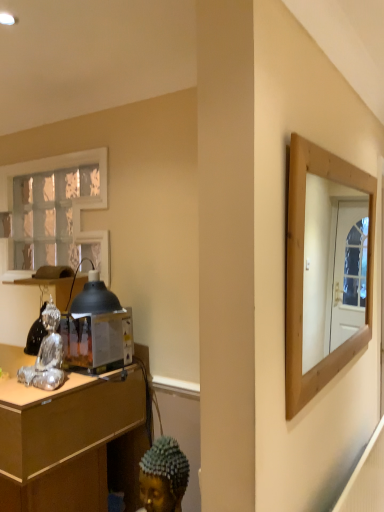
Question: Should I look upward or downward to see wooden desk at left?

Choices:
 (A) up
 (B) down

Answer: (B)

Question: Can you confirm if wooden desk at left is bigger than silver metallic figurine at left?

Choices:
 (A) yes
 (B) no

Answer: (A)

Question: Is wooden desk at left positioned beyond the bounds of silver metallic figurine at left?

Choices:
 (A) no
 (B) yes

Answer: (B)

Question: Considering the relative positions of wooden desk at left and silver metallic figurine at left in the image provided, is wooden desk at left to the left of silver metallic figurine at left from the viewer's perspective?

Choices:
 (A) no
 (B) yes

Answer: (B)

Question: Does wooden desk at left have a lesser height compared to silver metallic figurine at left?

Choices:
 (A) yes
 (B) no

Answer: (A)

Question: Would you say wooden desk at left is a long distance from silver metallic figurine at left?

Choices:
 (A) yes
 (B) no

Answer: (B)

Question: Is wooden desk at left surrounding silver metallic figurine at left?

Choices:
 (A) no
 (B) yes

Answer: (A)

Question: Is metallic/reflective toaster at left positioned far away from white textured glass at upper left?

Choices:
 (A) no
 (B) yes

Answer: (A)

Question: Considering the relative sizes of metallic/reflective toaster at left and white textured glass at upper left in the image provided, is metallic/reflective toaster at left taller than white textured glass at upper left?

Choices:
 (A) no
 (B) yes

Answer: (A)

Question: From the image's perspective, does metallic/reflective toaster at left appear higher than white textured glass at upper left?

Choices:
 (A) no
 (B) yes

Answer: (A)

Question: Considering the relative positions of metallic/reflective toaster at left and white textured glass at upper left in the image provided, is metallic/reflective toaster at left in front of white textured glass at upper left?

Choices:
 (A) no
 (B) yes

Answer: (B)

Question: From the image's perspective, is metallic/reflective toaster at left beneath white textured glass at upper left?

Choices:
 (A) no
 (B) yes

Answer: (B)

Question: Is white textured glass at upper left inside metallic/reflective toaster at left?

Choices:
 (A) no
 (B) yes

Answer: (A)

Question: From the image's perspective, is white textured glass at upper left located beneath metallic/reflective toaster at left?

Choices:
 (A) yes
 (B) no

Answer: (B)